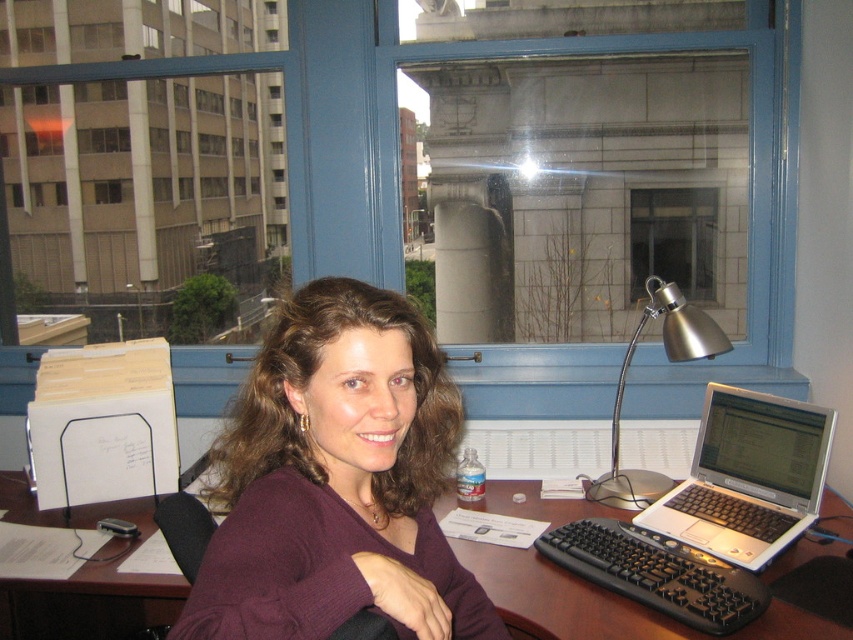
Does silver metallic laptop at right have a lesser height compared to satin silver desk lamp at right?

Yes.

Can you confirm if silver metallic laptop at right is bigger than satin silver desk lamp at right?

Actually, silver metallic laptop at right might be smaller than satin silver desk lamp at right.

What do you see at coordinates (747, 477) in the screenshot? This screenshot has height=640, width=853. I see `silver metallic laptop at right` at bounding box center [747, 477].

Locate an element on the screen. Image resolution: width=853 pixels, height=640 pixels. silver metallic laptop at right is located at coordinates (747, 477).

Does black plastic keyboard at lower center appear under clear glass window at center?

Yes.

Is point (637, 580) behind point (662, 243)?

No, it is in front of (662, 243).

The image size is (853, 640). In order to click on black plastic keyboard at lower center in this screenshot , I will do `click(657, 572)`.

This screenshot has width=853, height=640. What do you see at coordinates (337, 481) in the screenshot? I see `matte purple sweater at center` at bounding box center [337, 481].

Between matte purple sweater at center and satin silver desk lamp at right, which one is positioned lower?

Positioned lower is matte purple sweater at center.

What do you see at coordinates (337, 481) in the screenshot?
I see `matte purple sweater at center` at bounding box center [337, 481].

Where is `matte purple sweater at center`? The width and height of the screenshot is (853, 640). matte purple sweater at center is located at coordinates (337, 481).